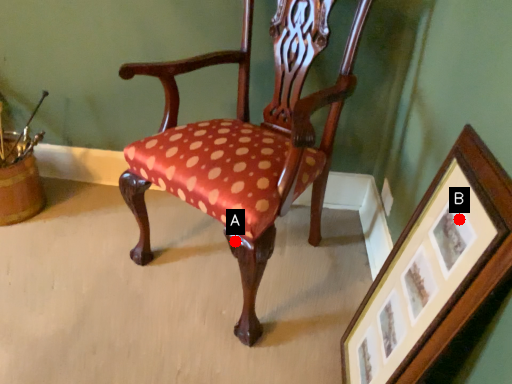
Question: Two points are circled on the image, labeled by A and B beside each circle. Which of the following is the closest to the observer?

Choices:
 (A) A is closer
 (B) B is closer

Answer: (B)